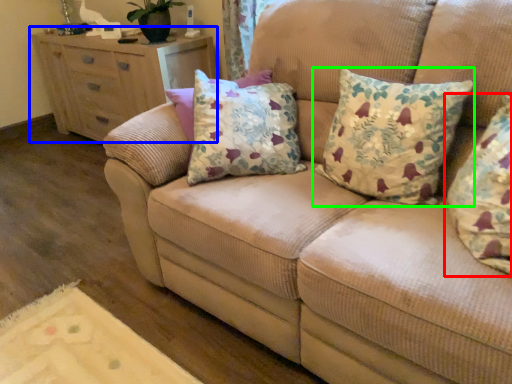
Question: Based on their relative distances, which object is farther from pillow (highlighted by a red box)? Choose from chest of drawers (highlighted by a blue box) and pillow (highlighted by a green box).

Choices:
 (A) chest of drawers
 (B) pillow

Answer: (A)